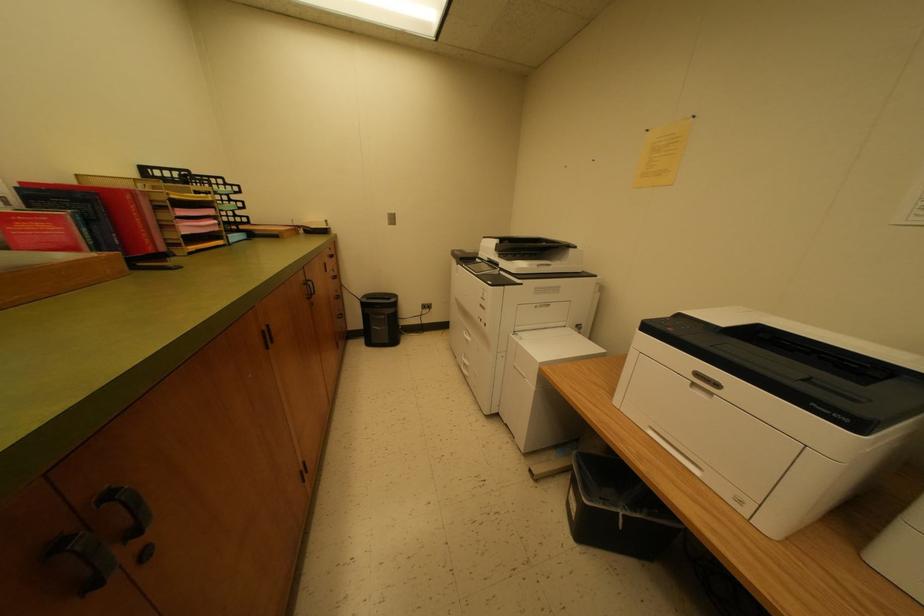
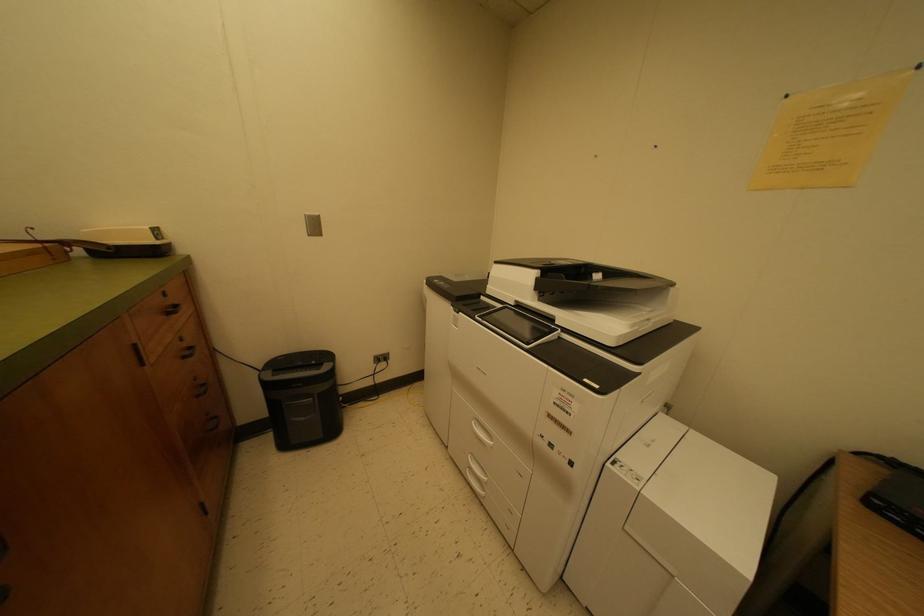
Which direction would the cameraman need to move to produce the second image?

The movement direction of the cameraman is left, forward.